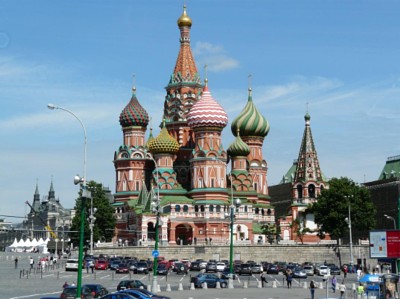
Where is `board`? This screenshot has width=400, height=299. board is located at coordinates (381, 245).